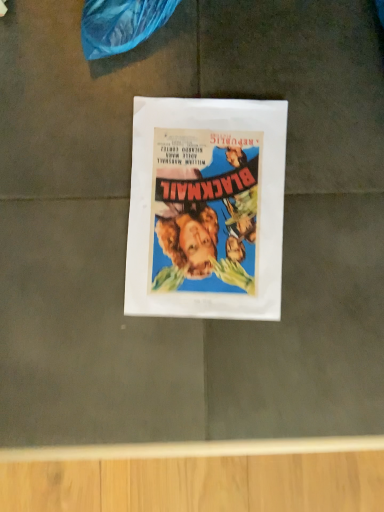
Find the location of a particular element. This screenshot has width=384, height=512. empty space that is ontop of matte paper poster at center (from a real-world perspective) is located at coordinates (205, 204).